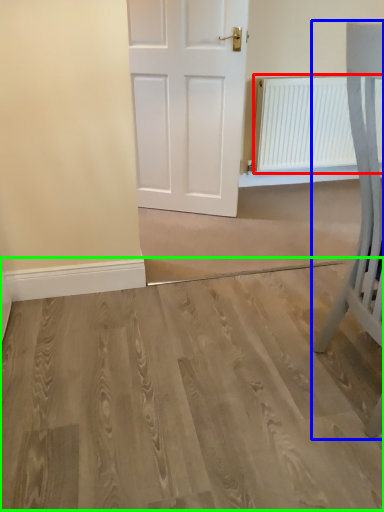
Question: Based on their relative distances, which object is farther from radiator (highlighted by a red box)? Choose from furniture (highlighted by a blue box) and plain (highlighted by a green box).

Choices:
 (A) furniture
 (B) plain

Answer: (B)